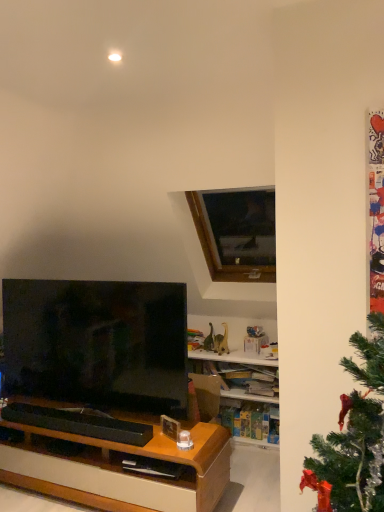
The height and width of the screenshot is (512, 384). Identify the location of matte black tv at left. (97, 342).

What do you see at coordinates (97, 342) in the screenshot? The height and width of the screenshot is (512, 384). I see `matte black tv at left` at bounding box center [97, 342].

Find the location of a particular element. The width and height of the screenshot is (384, 512). wooden frame at upper center is located at coordinates (236, 233).

Image resolution: width=384 pixels, height=512 pixels. Describe the element at coordinates (236, 233) in the screenshot. I see `wooden frame at upper center` at that location.

The width and height of the screenshot is (384, 512). What are the coordinates of `matte black tv at left` in the screenshot? It's located at (97, 342).

Based on the photo, is wooden frame at upper center to the left of matte black tv at left from the viewer's perspective?

Incorrect, wooden frame at upper center is not on the left side of matte black tv at left.

Is wooden frame at upper center in front of or behind matte black tv at left in the image?

In the image, wooden frame at upper center appears behind matte black tv at left.

Considering the points (225, 226) and (185, 381), which point is in front, point (225, 226) or point (185, 381)?

Positioned in front is point (185, 381).

From the image's perspective, is wooden frame at upper center above or below matte black tv at left?

wooden frame at upper center is above matte black tv at left.

From a real-world perspective, is wooden frame at upper center under matte black tv at left?

Actually, wooden frame at upper center is physically above matte black tv at left in the real world.

Looking at their sizes, would you say wooden frame at upper center is wider or thinner than matte black tv at left?

wooden frame at upper center is wider than matte black tv at left.

Considering the relative sizes of wooden frame at upper center and matte black tv at left in the image provided, is wooden frame at upper center taller than matte black tv at left?

In fact, wooden frame at upper center may be shorter than matte black tv at left.

Based on their sizes in the image, would you say wooden frame at upper center is bigger or smaller than matte black tv at left?

Clearly, wooden frame at upper center is larger in size than matte black tv at left.

Which is correct: wooden frame at upper center is inside matte black tv at left, or outside of it?

wooden frame at upper center is spatially situated outside matte black tv at left.

Is wooden frame at upper center not near matte black tv at left?

Yes, wooden frame at upper center is far from matte black tv at left.

Is wooden frame at upper center positioned with its back to matte black tv at left?

No, wooden frame at upper center is not facing away from matte black tv at left.

Can you tell me how much wooden frame at upper center and matte black tv at left differ in facing direction?

There is a 1.67-degree angle between the facing directions of wooden frame at upper center and matte black tv at left.

Image resolution: width=384 pixels, height=512 pixels. In order to click on television that is below the wooden frame at upper center (from the image's perspective) in this screenshot , I will do `click(97, 342)`.

Is matte black tv at left to the left of wooden frame at upper center from the viewer's perspective?

Indeed, matte black tv at left is positioned on the left side of wooden frame at upper center.

Which object is further away from the camera, matte black tv at left or wooden frame at upper center?

wooden frame at upper center is further away from the camera.

Which is closer, (113, 391) or (256, 214)?

Point (113, 391) appears to be closer to the viewer than point (256, 214).

From the image's perspective, who appears lower, matte black tv at left or wooden frame at upper center?

matte black tv at left, from the image's perspective.

From a real-world perspective, which is physically below, matte black tv at left or wooden frame at upper center?

matte black tv at left is physically lower.

Considering the sizes of objects matte black tv at left and wooden frame at upper center in the image provided, who is thinner, matte black tv at left or wooden frame at upper center?

matte black tv at left is thinner.

Considering the sizes of objects matte black tv at left and wooden frame at upper center in the image provided, who is taller, matte black tv at left or wooden frame at upper center?

matte black tv at left.

Between matte black tv at left and wooden frame at upper center, which one has larger size?

Bigger between the two is wooden frame at upper center.

Is wooden frame at upper center completely or partially inside matte black tv at left?

No, wooden frame at upper center is not a part of matte black tv at left.

Would you say matte black tv at left is a long distance from wooden frame at upper center?

matte black tv at left is far away from wooden frame at upper center.

Is matte black tv at left oriented towards wooden frame at upper center?

No.

Can you tell me how much matte black tv at left and wooden frame at upper center differ in facing direction?

The facing directions of matte black tv at left and wooden frame at upper center are 1.67 degrees apart.

This screenshot has width=384, height=512. I want to click on television below the wooden frame at upper center (from the image's perspective), so click(97, 342).

Identify the location of window that is above the matte black tv at left (from the image's perspective). (236, 233).

In the image, there is a wooden frame at upper center. Where is `television below it (from the image's perspective)`? television below it (from the image's perspective) is located at coordinates (97, 342).